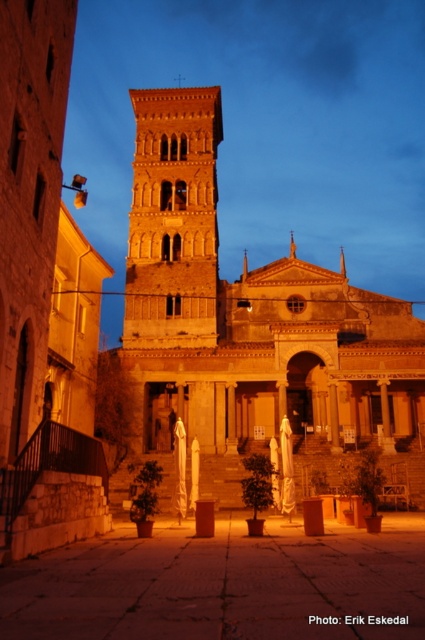
Question: Is brown stone alley at center positioned before golden stone tower at center?

Choices:
 (A) no
 (B) yes

Answer: (B)

Question: Does golden stone church at center have a smaller size compared to golden stone tower at center?

Choices:
 (A) yes
 (B) no

Answer: (B)

Question: Which object is farther from the camera taking this photo?

Choices:
 (A) golden stone church at center
 (B) golden stone tower at center

Answer: (B)

Question: Considering the real-world distances, which object is farthest from the brown stone alley at center?

Choices:
 (A) golden stone tower at center
 (B) golden stone church at center

Answer: (A)

Question: Considering the real-world distances, which object is closest to the brown stone alley at center?

Choices:
 (A) golden stone tower at center
 (B) golden stone church at center

Answer: (B)

Question: Is golden stone church at center wider than brown stone alley at center?

Choices:
 (A) yes
 (B) no

Answer: (A)